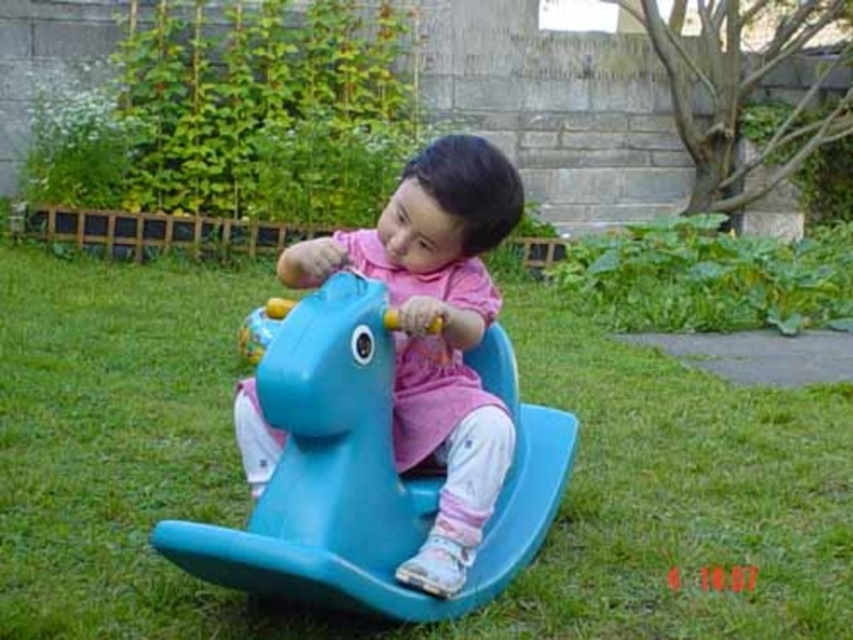
You are a parent trying to choose between two rocking horses for your child. The blue plastic horse at center and the matte plastic horse at center are available. Based on the scene, which one is wider?

The blue plastic horse at center is wider than the matte plastic horse at center according to the description.

You are standing in the garden and want to find the blue plastic horse at center. According to the coordinates provided, where should you look?

The blue plastic horse at center is located at coordinates point (367, 472).